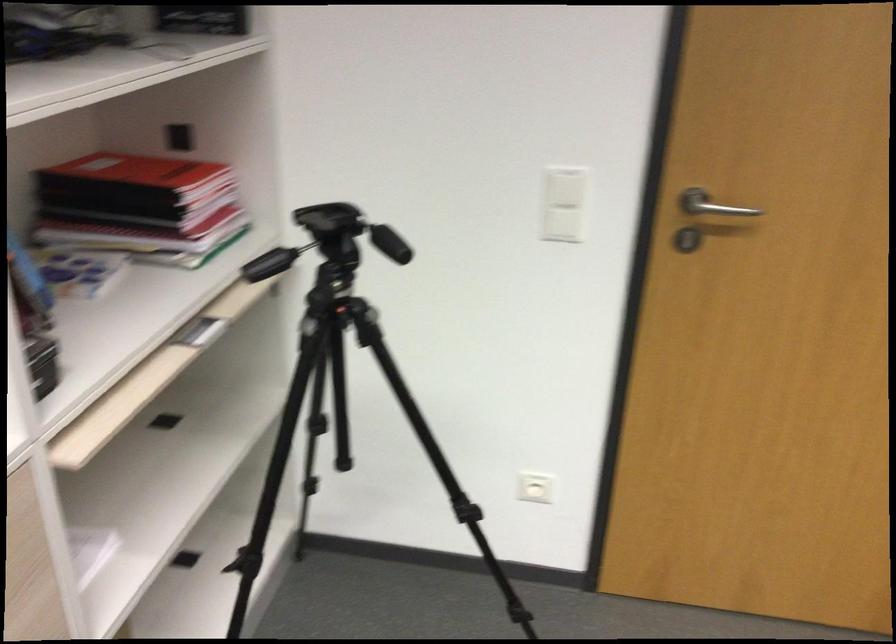
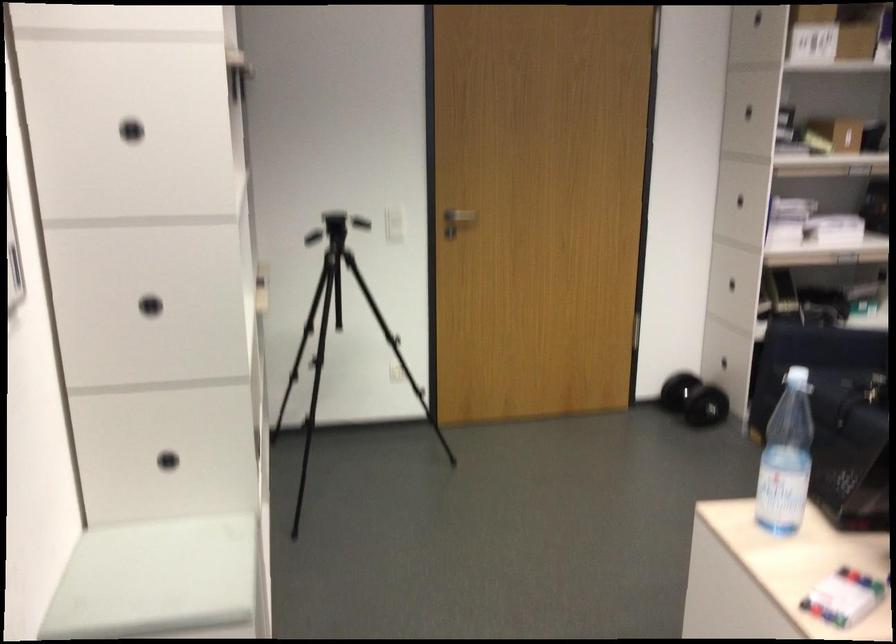
In the second image, find the point that corresponds to pixel 476 412 in the first image.

(339, 334)